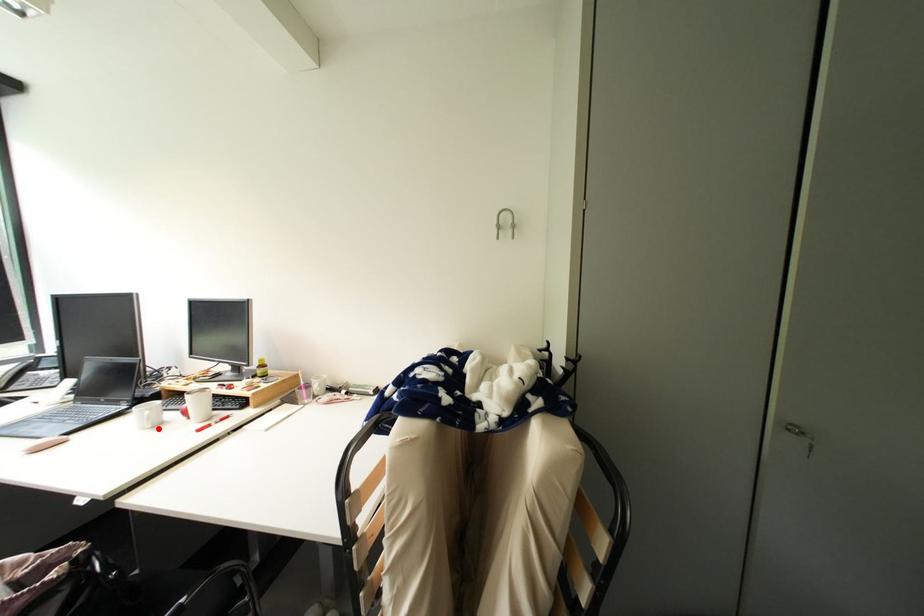
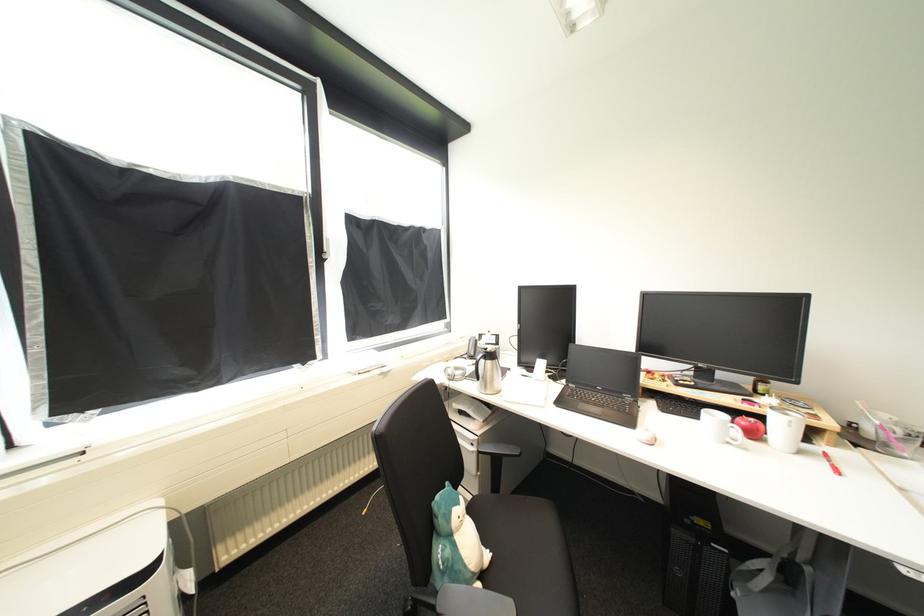
Locate, in the second image, the point that corresponds to the highlighted location in the first image.

(736, 445)